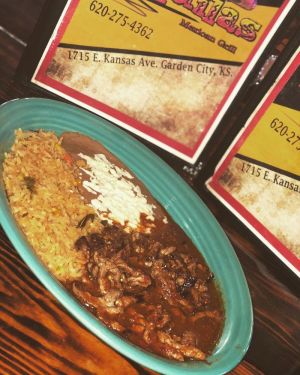
The image size is (300, 375). I want to click on white trim, so click(243, 134), click(242, 217), click(212, 134), click(165, 146), click(43, 65).